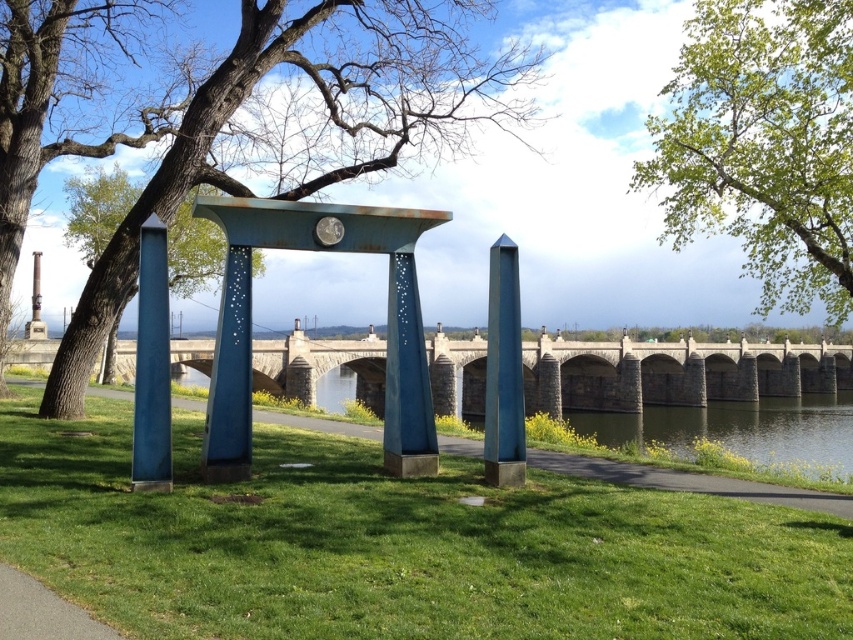
Which is below, brown bark tree at upper left or rusty blue metal arch at center?

Positioned lower is rusty blue metal arch at center.

Is brown bark tree at upper left shorter than rusty blue metal arch at center?

In fact, brown bark tree at upper left may be taller than rusty blue metal arch at center.

I want to click on brown bark tree at upper left, so click(x=306, y=129).

Is rusty metal pillar at center positioned before gravel path at lower left?

No.

Does rusty metal pillar at center appear under gravel path at lower left?

No.

This screenshot has width=853, height=640. Find the location of `rusty metal pillar at center`. rusty metal pillar at center is located at coordinates (405, 378).

This screenshot has height=640, width=853. Describe the element at coordinates (398, 545) in the screenshot. I see `green grass at center` at that location.

This screenshot has width=853, height=640. Describe the element at coordinates (398, 545) in the screenshot. I see `green grass at center` at that location.

This screenshot has height=640, width=853. Identify the location of green grass at center. (398, 545).